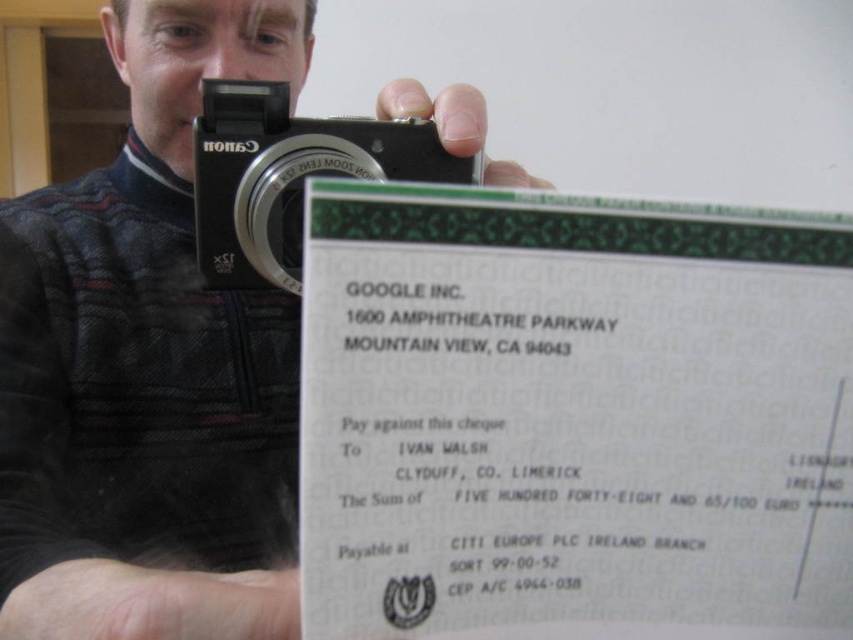
Question: Is black plastic camera at upper center to the right of black matte camera at upper center from the viewer's perspective?

Choices:
 (A) yes
 (B) no

Answer: (B)

Question: Can you confirm if white paper at center is smaller than black matte camera at upper center?

Choices:
 (A) yes
 (B) no

Answer: (B)

Question: Is black plastic camera at upper center below black matte camera at upper center?

Choices:
 (A) yes
 (B) no

Answer: (A)

Question: Estimate the real-world distances between objects in this image. Which object is closer to the black plastic camera at upper center?

Choices:
 (A) black matte camera at upper center
 (B) white paper at center

Answer: (A)

Question: Which of these objects is positioned farthest from the black plastic camera at upper center?

Choices:
 (A) black matte camera at upper center
 (B) white paper at center

Answer: (B)

Question: Which point is farther from the camera taking this photo?

Choices:
 (A) (68, 582)
 (B) (289, 218)

Answer: (B)